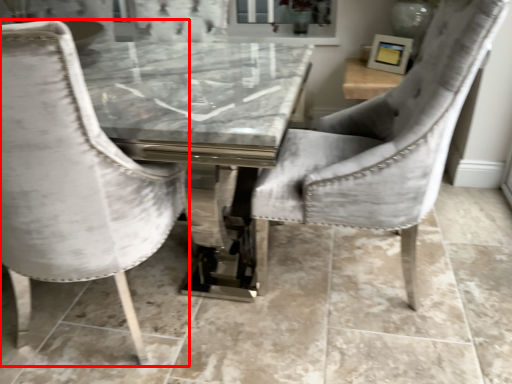
Question: From the image's perspective, where is chair (annotated by the red box) located relative to chair?

Choices:
 (A) below
 (B) above

Answer: (A)